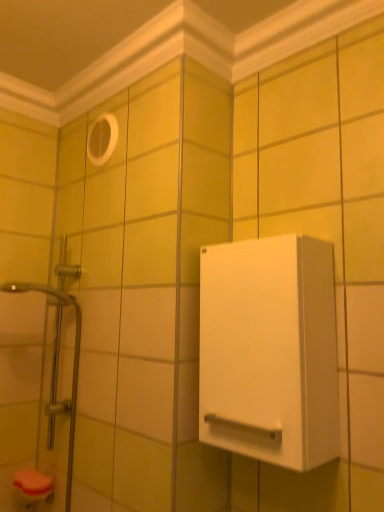
Question: From a real-world perspective, is white plastic hole at upper center located beneath white matte cabinet at right?

Choices:
 (A) yes
 (B) no

Answer: (B)

Question: Is white plastic hole at upper center bigger than white matte cabinet at right?

Choices:
 (A) yes
 (B) no

Answer: (B)

Question: From the image's perspective, is white plastic hole at upper center on white matte cabinet at right?

Choices:
 (A) no
 (B) yes

Answer: (B)

Question: Is white plastic hole at upper center turned away from white matte cabinet at right?

Choices:
 (A) no
 (B) yes

Answer: (A)

Question: Considering the relative positions of white plastic hole at upper center and white matte cabinet at right in the image provided, is white plastic hole at upper center to the left of white matte cabinet at right from the viewer's perspective?

Choices:
 (A) yes
 (B) no

Answer: (A)

Question: Does white plastic hole at upper center have a lesser width compared to white matte cabinet at right?

Choices:
 (A) no
 (B) yes

Answer: (B)

Question: Can you confirm if white plastic hole at upper center is positioned to the right of translucent glass shower door at left?

Choices:
 (A) no
 (B) yes

Answer: (B)

Question: From the image's perspective, is white plastic hole at upper center beneath translucent glass shower door at left?

Choices:
 (A) no
 (B) yes

Answer: (A)

Question: Is white plastic hole at upper center aimed at translucent glass shower door at left?

Choices:
 (A) no
 (B) yes

Answer: (A)

Question: From a real-world perspective, is white plastic hole at upper center over translucent glass shower door at left?

Choices:
 (A) yes
 (B) no

Answer: (A)

Question: Is translucent glass shower door at left at the back of white plastic hole at upper center?

Choices:
 (A) no
 (B) yes

Answer: (A)

Question: Does white plastic hole at upper center have a greater width compared to translucent glass shower door at left?

Choices:
 (A) yes
 (B) no

Answer: (B)

Question: Does white matte cabinet at right have a lesser width compared to translucent glass shower door at left?

Choices:
 (A) no
 (B) yes

Answer: (B)